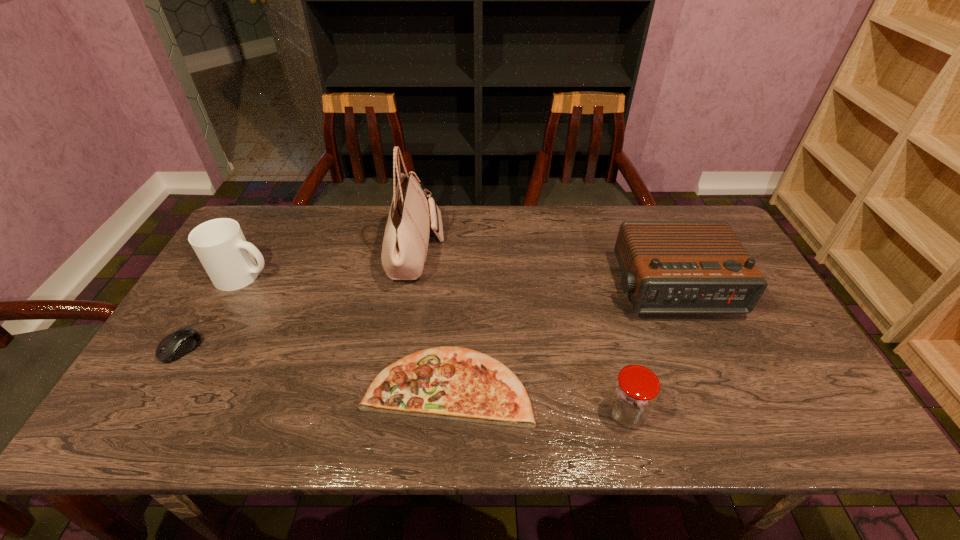
This screenshot has width=960, height=540. I want to click on unoccupied area between the mouse and the mug, so click(x=212, y=312).

You are a GUI agent. You are given a task and a screenshot of the screen. Output one action in this format:
    pyautogui.click(x=<x>, y=<y>)
    Task: Click on the blank region between the pizza and the fourth tallest object
    
    Given the screenshot: What is the action you would take?
    pyautogui.click(x=537, y=400)

Locate which object is the fourth closest to the pizza. Please provide its 2D coordinates. Your answer should be formatted as a tuple, i.e. [(x, y)], where the tuple contains the x and y coordinates of a point satisfying the conditions above.

[(220, 245)]

Find the location of a particular element. The image size is (960, 540). object that is the nearest to the mouse is located at coordinates (220, 245).

At what (x,y) coordinates should I click in order to perform the action: click on free point that satisfies the following two spatial constraints: 1. on the back side of the pizza; 2. on the side of the handbag with the attached pouch. Please return your answer as a coordinate pair (x, y). Looking at the image, I should click on (456, 252).

Find the location of a particular element. vacant space that satisfies the following two spatial constraints: 1. on the handle side of the mug; 2. on the left side of the pizza is located at coordinates (182, 386).

This screenshot has width=960, height=540. Find the location of `free space that satisfies the following two spatial constraints: 1. on the front side of the third shortest object; 2. on the right side of the mouse`. free space that satisfies the following two spatial constraints: 1. on the front side of the third shortest object; 2. on the right side of the mouse is located at coordinates (142, 414).

The image size is (960, 540). Find the location of `vacant position in the image that satisfies the following two spatial constraints: 1. on the handle side of the mug; 2. on the front side of the mouse`. vacant position in the image that satisfies the following two spatial constraints: 1. on the handle side of the mug; 2. on the front side of the mouse is located at coordinates pyautogui.click(x=204, y=349).